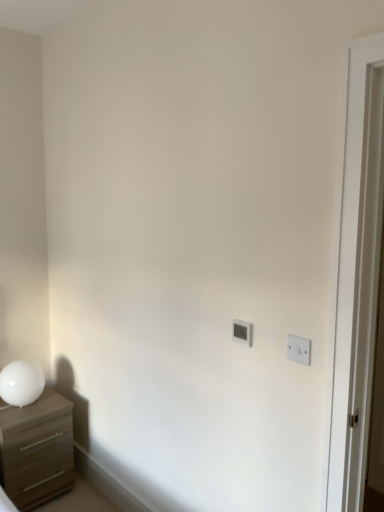
Question: From the image's perspective, relative to white glossy table lamp at left, is white plastic light switch at upper right, marked as the first light switch in a right-to-left arrangement, above or below?

Choices:
 (A) below
 (B) above

Answer: (B)

Question: Considering the positions of white plastic light switch at upper right, which is the 2th light switch in back-to-front order, and white glossy table lamp at left in the image, is white plastic light switch at upper right, which is the 2th light switch in back-to-front order, wider or thinner than white glossy table lamp at left?

Choices:
 (A) thin
 (B) wide

Answer: (A)

Question: Which is farther from the white plastic light switch at upper right, which is the 2th light switch in back-to-front order?

Choices:
 (A) matte brown chest of drawers at left
 (B) white glossy table lamp at left
 (C) white plastic light switch at center, arranged as the second light switch when viewed from the right

Answer: (A)

Question: Which is farther from the white plastic light switch at center, the first light switch when ordered from back to front?

Choices:
 (A) white plastic light switch at upper right, which is the 2th light switch in back-to-front order
 (B) matte brown chest of drawers at left
 (C) white glossy table lamp at left

Answer: (B)